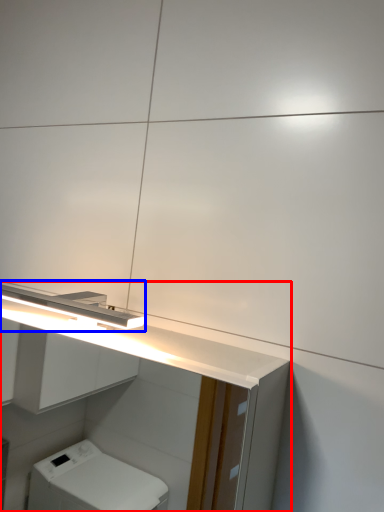
Question: Which object appears closest to the camera in this image, bathroom cabinet (highlighted by a red box) or light fixture (highlighted by a blue box)?

Choices:
 (A) bathroom cabinet
 (B) light fixture

Answer: (A)